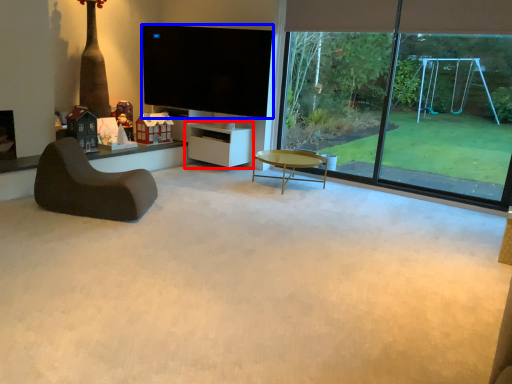
Question: Which object appears closest to the camera in this image, shelf (highlighted by a red box) or television (highlighted by a blue box)?

Choices:
 (A) shelf
 (B) television

Answer: (B)